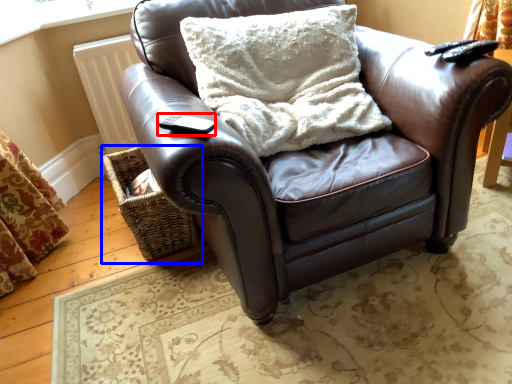
Question: Which object appears farthest to the camera in this image, remote (highlighted by a red box) or basket (highlighted by a blue box)?

Choices:
 (A) remote
 (B) basket

Answer: (B)